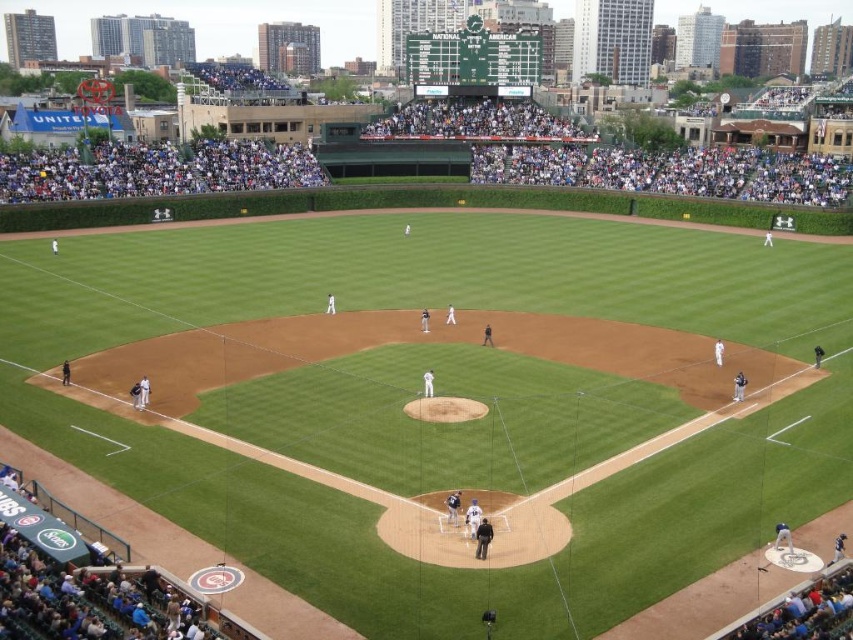
Question: Where is white fabric crowd at upper left located in relation to dark gray uniform at lower right in the image?

Choices:
 (A) right
 (B) left

Answer: (B)

Question: Which of these objects is positioned farthest from the white fabric crowd at upper left?

Choices:
 (A) dark gray uniform at lower right
 (B) white uniform at center

Answer: (A)

Question: Which object is positioned closest to the white uniform at center?

Choices:
 (A) white fabric crowd at upper left
 (B) dark gray uniform at lower right

Answer: (B)

Question: Is white fabric crowd at upper left bigger than dark gray uniform at lower right?

Choices:
 (A) yes
 (B) no

Answer: (A)

Question: Which point is farther to the camera?

Choices:
 (A) white uniform at center
 (B) dark gray uniform at lower right
 (C) white fabric crowd at upper left

Answer: (C)

Question: Does white fabric crowd at upper left have a smaller size compared to dark gray uniform at lower right?

Choices:
 (A) yes
 (B) no

Answer: (B)